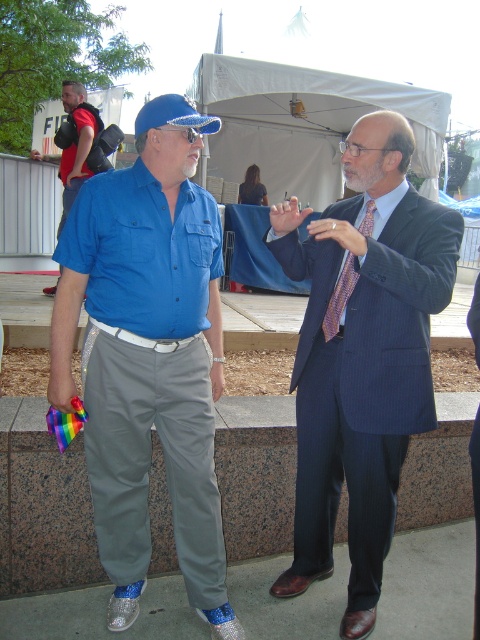
Question: Can you confirm if blue knitted baseball hat at upper center is thinner than blue beaded goggles at center?

Choices:
 (A) yes
 (B) no

Answer: (B)

Question: Which object is the closest to the matte black backpack at upper left?

Choices:
 (A) blue knitted baseball hat at upper center
 (B) silky blue suit at center
 (C) blue beaded goggles at center

Answer: (A)

Question: Is the position of matte black backpack at upper left more distant than that of silky blue suit at center?

Choices:
 (A) yes
 (B) no

Answer: (A)

Question: Where is shiny metallic shoes at lower center located in relation to matte black backpack at upper left in the image?

Choices:
 (A) left
 (B) right

Answer: (B)

Question: Which point appears closest to the camera in this image?

Choices:
 (A) (186, 122)
 (B) (476, 444)
 (C) (360, 230)
 (D) (304, 566)

Answer: (B)

Question: Which object is closer to the camera taking this photo?

Choices:
 (A) silky blue suit at center
 (B) blue pinstripe suit at center
 (C) purple striped tie at center

Answer: (A)